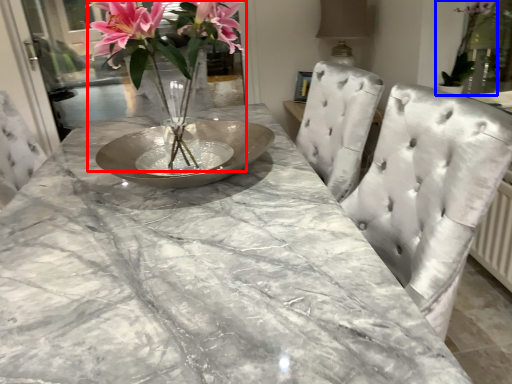
Question: Which object is closer to the camera taking this photo, floral arrangement (highlighted by a red box) or houseplant (highlighted by a blue box)?

Choices:
 (A) floral arrangement
 (B) houseplant

Answer: (A)